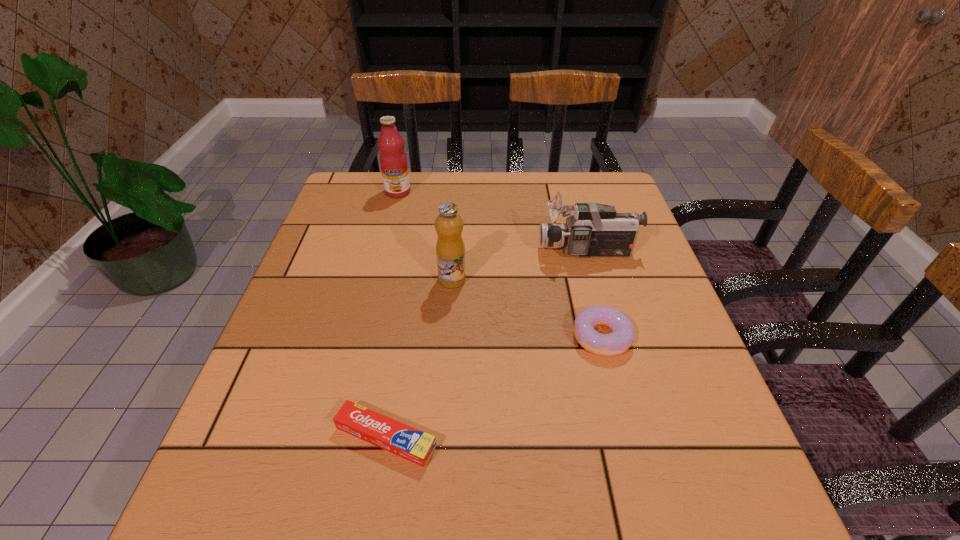
Where is `the farther fruit juice`? The width and height of the screenshot is (960, 540). the farther fruit juice is located at coordinates (393, 161).

Where is `the farthest object`? This screenshot has height=540, width=960. the farthest object is located at coordinates (393, 161).

You are a GUI agent. You are given a task and a screenshot of the screen. Output one action in this format:
    pyautogui.click(x=<x>, y=<y>)
    Task: Click on the third farthest object
    Image resolution: width=960 pixels, height=540 pixels.
    Given the screenshot: What is the action you would take?
    pyautogui.click(x=450, y=250)

Where is `the nearer fruit juice`? the nearer fruit juice is located at coordinates pos(450,250).

This screenshot has width=960, height=540. I want to click on the third shortest object, so click(x=592, y=230).

Where is `camcorder`? This screenshot has width=960, height=540. camcorder is located at coordinates (592, 230).

Identify the location of the second nearest object. [x=622, y=336].

Find the location of a particular element. This screenshot has width=960, height=540. doughnut is located at coordinates (622, 336).

Where is `toothpaste`? The height and width of the screenshot is (540, 960). toothpaste is located at coordinates (414, 445).

At what (x,y) coordinates should I click in order to perform the action: click on the shortest object. Please return your answer as a coordinate pair (x, y). Looking at the image, I should click on (414, 445).